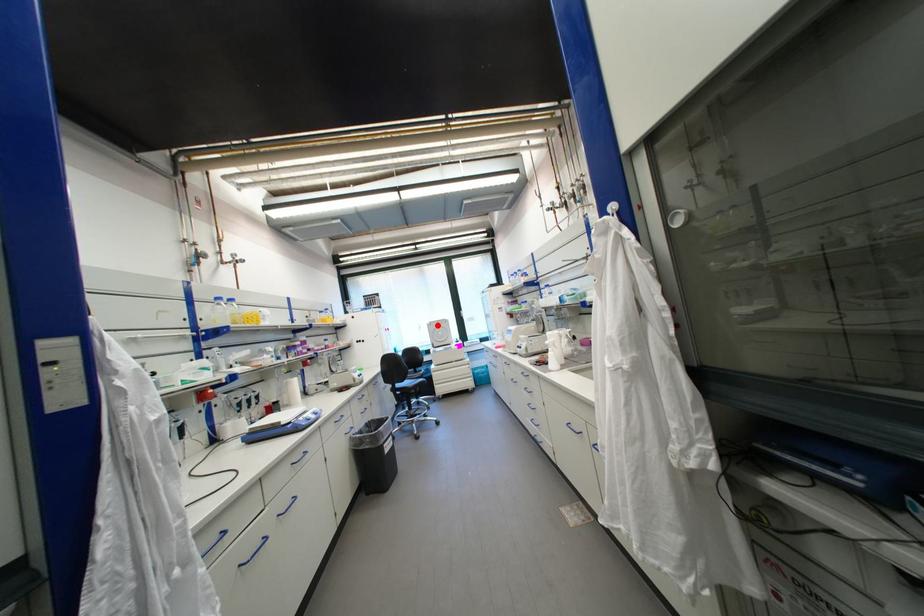
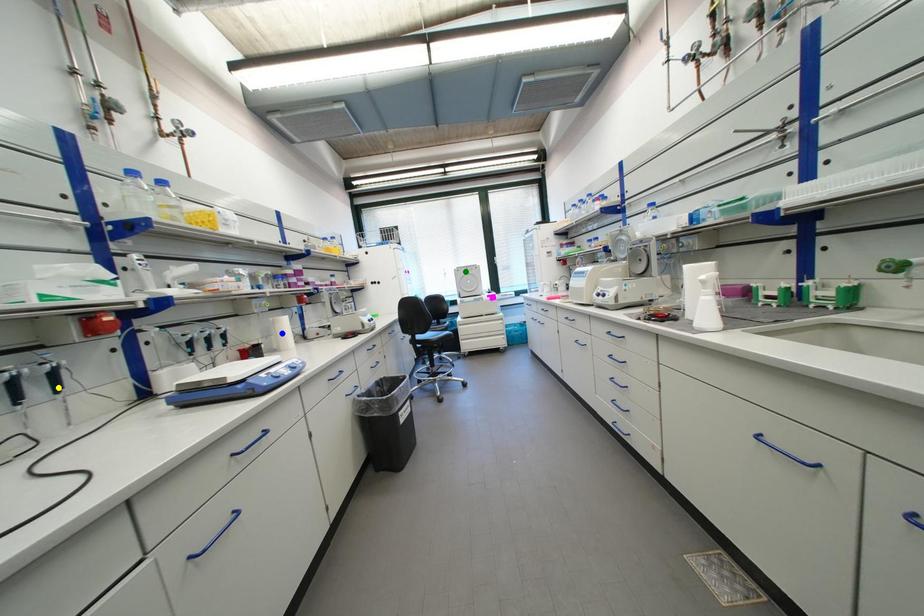
Question: I am providing you with two images of the same scene from different viewpoints. A red point is marked on the first image. You are given multiple points on the second image. Can you choose the point in image 2 that corresponds to the point in image 1?

Choices:
 (A) yellow point
 (B) green point
 (C) blue point

Answer: (B)